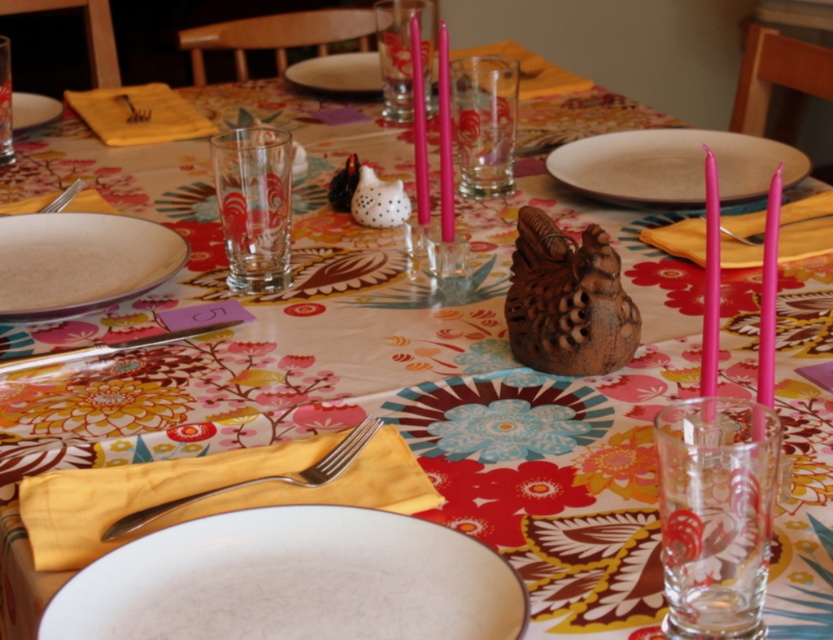
Question: Which point is farther from the camera taking this photo?

Choices:
 (A) (125, 100)
 (B) (161, 513)

Answer: (A)

Question: Which point is farther from the camera taking this photo?

Choices:
 (A) (8, 316)
 (B) (352, 444)

Answer: (A)

Question: Is beige ceramic plate at upper center positioned before brushed metal fork at upper left?

Choices:
 (A) no
 (B) yes

Answer: (B)

Question: Which object is the closest to the silver metallic fork at lower left?

Choices:
 (A) white glossy plate at upper left
 (B) transparent glass candle holder at center

Answer: (B)

Question: Is transparent glass at center above white glossy plate at upper left?

Choices:
 (A) yes
 (B) no

Answer: (A)

Question: Can you confirm if transparent glass at center is bigger than brushed metal fork at upper left?

Choices:
 (A) yes
 (B) no

Answer: (A)